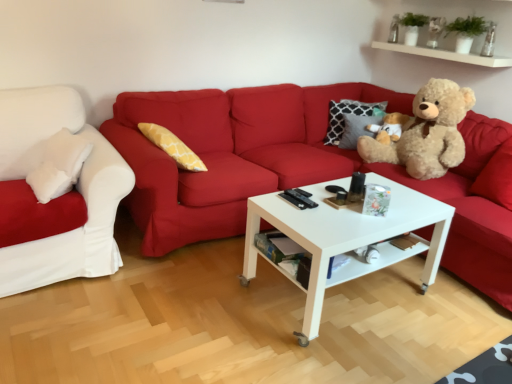
This screenshot has height=384, width=512. What are the coordinates of `white glossy coffee table at center` in the screenshot? It's located at (347, 238).

The width and height of the screenshot is (512, 384). What are the coordinates of `white soft cushion at left, marked as the 1th studio couch in a left-to-right arrangement` in the screenshot? It's located at (55, 191).

Is matte red couch at center, the 2th studio couch viewed from the left, taller than white soft cushion at left, marked as the 1th studio couch in a left-to-right arrangement?

Indeed, matte red couch at center, the 2th studio couch viewed from the left, has a greater height compared to white soft cushion at left, marked as the 1th studio couch in a left-to-right arrangement.

Considering the positions of points (192, 201) and (72, 194), is point (192, 201) closer to camera compared to point (72, 194)?

No, (192, 201) is behind (72, 194).

Is matte red couch at center, which is counted as the first studio couch, starting from the right, with white soft cushion at left, which is counted as the second studio couch, starting from the right?

No, matte red couch at center, which is counted as the first studio couch, starting from the right, is not beside white soft cushion at left, which is counted as the second studio couch, starting from the right.

In the scene shown: Could you tell me if matte red couch at center, which is counted as the first studio couch, starting from the right, is facing white soft cushion at left, marked as the 1th studio couch in a left-to-right arrangement?

No, matte red couch at center, which is counted as the first studio couch, starting from the right, is not oriented towards white soft cushion at left, marked as the 1th studio couch in a left-to-right arrangement.

Which of these two, matte red couch at center, which is counted as the first studio couch, starting from the right, or white glossy shelf at upper right, is thinner?

Thinner between the two is white glossy shelf at upper right.

Is matte red couch at center, the 2th studio couch viewed from the left, positioned with its back to white glossy shelf at upper right?

No, white glossy shelf at upper right is not at the back of matte red couch at center, the 2th studio couch viewed from the left.

Which point is more forward, [263,186] or [492,63]?

Point [263,186]

From the image's perspective, is matte red couch at center, the 2th studio couch viewed from the left, located above or below white glossy shelf at upper right?

Clearly, from the image's perspective, matte red couch at center, the 2th studio couch viewed from the left, is below white glossy shelf at upper right.

Consider the image. Is white glossy coffee table at center not near white soft cushion at left, marked as the 1th studio couch in a left-to-right arrangement?

Result: Yes, white glossy coffee table at center and white soft cushion at left, marked as the 1th studio couch in a left-to-right arrangement, are quite far apart.

Is white glossy coffee table at center further to the viewer compared to white soft cushion at left, marked as the 1th studio couch in a left-to-right arrangement?

That is False.

Consider the image. In terms of height, does white glossy coffee table at center look taller or shorter compared to white soft cushion at left, which is counted as the second studio couch, starting from the right?

Clearly, white glossy coffee table at center is shorter compared to white soft cushion at left, which is counted as the second studio couch, starting from the right.

From a real-world perspective, between white glossy shelf at upper right and light brown plush teddy bear at right, who is vertically higher?

In real-world perspective, white glossy shelf at upper right is above.

Looking at this image, can you confirm if white glossy shelf at upper right is thinner than light brown plush teddy bear at right?

Yes.

Which of these two, white glossy shelf at upper right or light brown plush teddy bear at right, stands taller?

light brown plush teddy bear at right.

Would you say white glossy shelf at upper right contains light brown plush teddy bear at right?

No.

Is point (507, 66) positioned before point (269, 125)?

Yes, point (507, 66) is in front of point (269, 125).

Is white glossy shelf at upper right facing towards matte red couch at center, which is counted as the first studio couch, starting from the right?

No, white glossy shelf at upper right is not turned towards matte red couch at center, which is counted as the first studio couch, starting from the right.

From a real-world perspective, does white glossy shelf at upper right sit lower than matte red couch at center, the 2th studio couch viewed from the left?

No, from a real-world perspective, white glossy shelf at upper right is not under matte red couch at center, the 2th studio couch viewed from the left.

From the image's perspective, is white glossy shelf at upper right above matte red couch at center, which is counted as the first studio couch, starting from the right?

Indeed, from the image's perspective, white glossy shelf at upper right is shown above matte red couch at center, which is counted as the first studio couch, starting from the right.

Who is bigger, white soft cushion at left, marked as the 1th studio couch in a left-to-right arrangement, or white glossy coffee table at center?

white glossy coffee table at center is bigger.

From a real-world perspective, is white soft cushion at left, marked as the 1th studio couch in a left-to-right arrangement, positioned over white glossy coffee table at center based on gravity?

Yes.

Locate an element on the screen. studio couch located behind the white glossy coffee table at center is located at coordinates (55, 191).

Is white soft cushion at left, which is counted as the second studio couch, starting from the right, next to white glossy coffee table at center?

white soft cushion at left, which is counted as the second studio couch, starting from the right, is not next to white glossy coffee table at center, and they're not touching.

Looking at their sizes, would you say light brown plush teddy bear at right is wider or thinner than white glossy coffee table at center?

light brown plush teddy bear at right is thinner than white glossy coffee table at center.

From a real-world perspective, is light brown plush teddy bear at right on top of white glossy coffee table at center?

Yes, from a real-world perspective, light brown plush teddy bear at right is on top of white glossy coffee table at center.

How distant is light brown plush teddy bear at right from white glossy coffee table at center?

light brown plush teddy bear at right is 31.47 inches from white glossy coffee table at center.

Is light brown plush teddy bear at right at the left side of white glossy coffee table at center?

Incorrect, light brown plush teddy bear at right is not on the left side of white glossy coffee table at center.

What are the coordinates of `studio couch directly beneath the white soft cushion at left, marked as the 1th studio couch in a left-to-right arrangement (from a real-world perspective)` in the screenshot? It's located at (298, 168).

The width and height of the screenshot is (512, 384). I want to click on shelf on the right side of matte red couch at center, which is counted as the first studio couch, starting from the right, so coord(446,55).

Which object lies further to the anchor point matte red couch at center, which is counted as the first studio couch, starting from the right, light brown plush teddy bear at right or white glossy shelf at upper right?

Among the two, white glossy shelf at upper right is located further to matte red couch at center, which is counted as the first studio couch, starting from the right.

Based on the photo, based on their spatial positions, is matte red couch at center, the 2th studio couch viewed from the left, or light brown plush teddy bear at right closer to white glossy coffee table at center?

matte red couch at center, the 2th studio couch viewed from the left.

In the scene shown: Which object lies nearer to the anchor point light brown plush teddy bear at right, matte red couch at center, which is counted as the first studio couch, starting from the right, or white glossy coffee table at center?

matte red couch at center, which is counted as the first studio couch, starting from the right, lies closer to light brown plush teddy bear at right than the other object.

From the picture: Which object lies further to the anchor point light brown plush teddy bear at right, matte red couch at center, which is counted as the first studio couch, starting from the right, or white soft cushion at left, which is counted as the second studio couch, starting from the right?

white soft cushion at left, which is counted as the second studio couch, starting from the right, is further to light brown plush teddy bear at right.

Based on their spatial positions, is white soft cushion at left, marked as the 1th studio couch in a left-to-right arrangement, or light brown plush teddy bear at right further from white glossy shelf at upper right?

The object further to white glossy shelf at upper right is white soft cushion at left, marked as the 1th studio couch in a left-to-right arrangement.

When comparing their distances from matte red couch at center, which is counted as the first studio couch, starting from the right, does white glossy coffee table at center or white soft cushion at left, which is counted as the second studio couch, starting from the right, seem further?

white soft cushion at left, which is counted as the second studio couch, starting from the right.

In the scene shown: Estimate the real-world distances between objects in this image. Which object is further from white glossy coffee table at center, white soft cushion at left, marked as the 1th studio couch in a left-to-right arrangement, or matte red couch at center, the 2th studio couch viewed from the left?

white soft cushion at left, marked as the 1th studio couch in a left-to-right arrangement, is further to white glossy coffee table at center.

Looking at the image, which one is located closer to light brown plush teddy bear at right, white glossy shelf at upper right or white glossy coffee table at center?

white glossy shelf at upper right is positioned closer to the anchor light brown plush teddy bear at right.

The height and width of the screenshot is (384, 512). I want to click on teddy bear positioned between matte red couch at center, which is counted as the first studio couch, starting from the right, and white glossy shelf at upper right from near to far, so click(x=426, y=132).

You are a GUI agent. You are given a task and a screenshot of the screen. Output one action in this format:
    pyautogui.click(x=<x>, y=<y>)
    Task: Click on the coffee table between white soft cushion at left, which is counted as the second studio couch, starting from the right, and white glossy shelf at upper right
    Image resolution: width=512 pixels, height=384 pixels.
    Given the screenshot: What is the action you would take?
    pyautogui.click(x=347, y=238)

Locate an element on the screen. coffee table between white soft cushion at left, marked as the 1th studio couch in a left-to-right arrangement, and light brown plush teddy bear at right, in the horizontal direction is located at coordinates (347, 238).

I want to click on coffee table located between matte red couch at center, which is counted as the first studio couch, starting from the right, and white glossy shelf at upper right in the depth direction, so point(347,238).